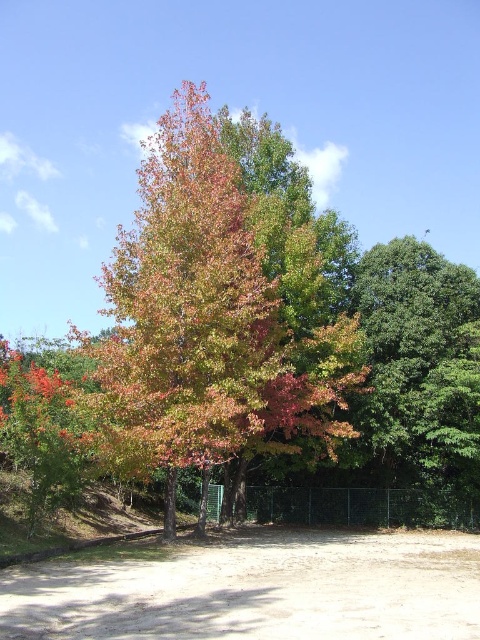
Question: Which point is closer to the camera?

Choices:
 (A) multicolored foliage at center
 (B) brown sandy dirt field at lower center
 (C) green glossy tree at right

Answer: (B)

Question: Is brown sandy dirt field at lower center to the right of green glossy tree at right from the viewer's perspective?

Choices:
 (A) no
 (B) yes

Answer: (A)

Question: Based on their relative distances, which object is farther from the green glossy tree at right?

Choices:
 (A) brown sandy dirt field at lower center
 (B) multicolored foliage at center

Answer: (A)

Question: Is the position of multicolored foliage at center less distant than that of brown sandy dirt field at lower center?

Choices:
 (A) no
 (B) yes

Answer: (A)

Question: Which point is closer to the camera?

Choices:
 (A) [213, 262]
 (B) [477, 371]
 (C) [348, 593]

Answer: (C)

Question: Observing the image, what is the correct spatial positioning of brown sandy dirt field at lower center in reference to green glossy tree at right?

Choices:
 (A) above
 (B) below

Answer: (B)